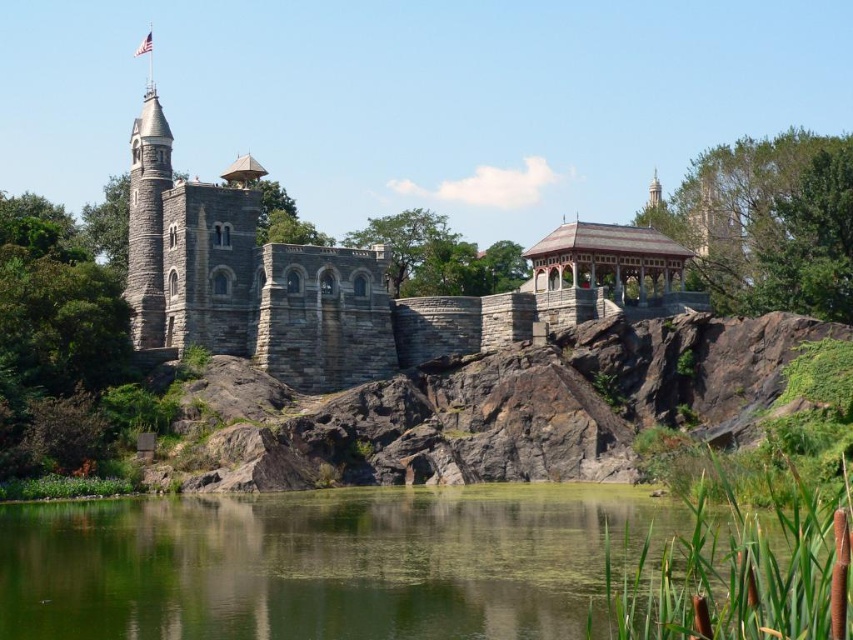
Looking at this image, you are standing at the base of the gray stone tower at upper left and want to get to the green liquid water at lower center. Which direction should you move to reach it?

You should move downward from the gray stone tower at upper left to reach the green liquid water at lower center since it is located below the tower.

You are a tourist standing in front of the historic stone structure. You see the green liquid water at lower center and the gray stone tower at upper left. Which object is located to the right of the other?

The green liquid water at lower center is positioned on the right side of gray stone tower at upper left.